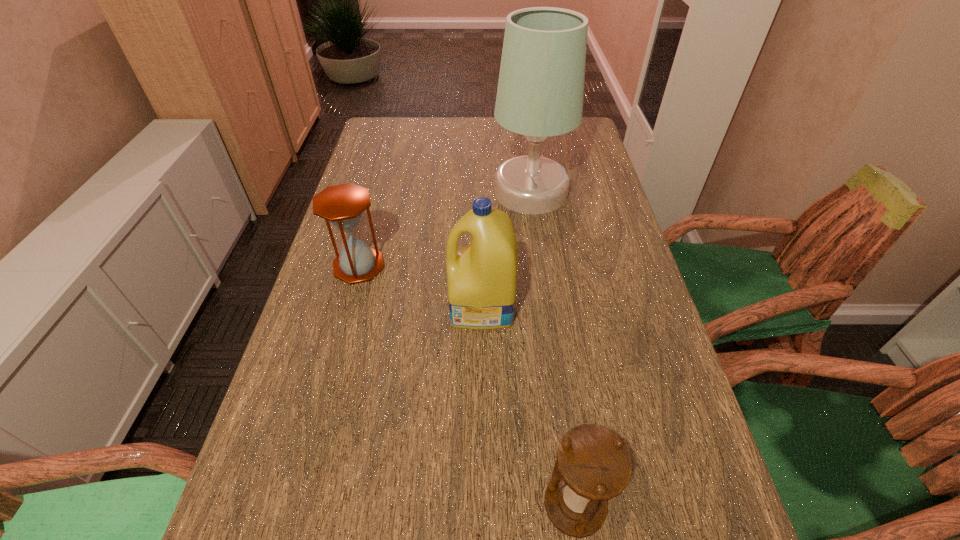
The image size is (960, 540). What are the coordinates of `blank space at the far left corner of the desktop` in the screenshot? It's located at (418, 119).

Locate an element on the screen. vacant space at the far right corner of the desktop is located at coordinates (584, 117).

Find the location of a particular element. The width and height of the screenshot is (960, 540). free space that is in between the leftmost object and the tallest object is located at coordinates (444, 229).

You are a GUI agent. You are given a task and a screenshot of the screen. Output one action in this format:
    pyautogui.click(x=<x>, y=<y>)
    Task: Click on the free space between the leftmost object and the detergent
    This screenshot has width=960, height=540.
    Given the screenshot: What is the action you would take?
    pyautogui.click(x=420, y=286)

Find the location of a particular element. free space between the second tallest object and the nearer hourglass is located at coordinates (528, 406).

This screenshot has width=960, height=540. I want to click on vacant point located between the leftmost object and the nearest object, so click(467, 386).

This screenshot has width=960, height=540. I want to click on vacant region between the nearest object and the second tallest object, so pyautogui.click(x=528, y=406).

At what (x,y) coordinates should I click in order to perform the action: click on vacant point located between the right hourglass and the detergent. Please return your answer as a coordinate pair (x, y). Looking at the image, I should click on (528, 406).

I want to click on free space between the left hourglass and the second tallest object, so click(x=420, y=286).

You are a GUI agent. You are given a task and a screenshot of the screen. Output one action in this format:
    pyautogui.click(x=<x>, y=<y>)
    Task: Click on the free point between the farthest object and the farther hourglass
    The image size is (960, 540).
    Given the screenshot: What is the action you would take?
    [x=444, y=229]